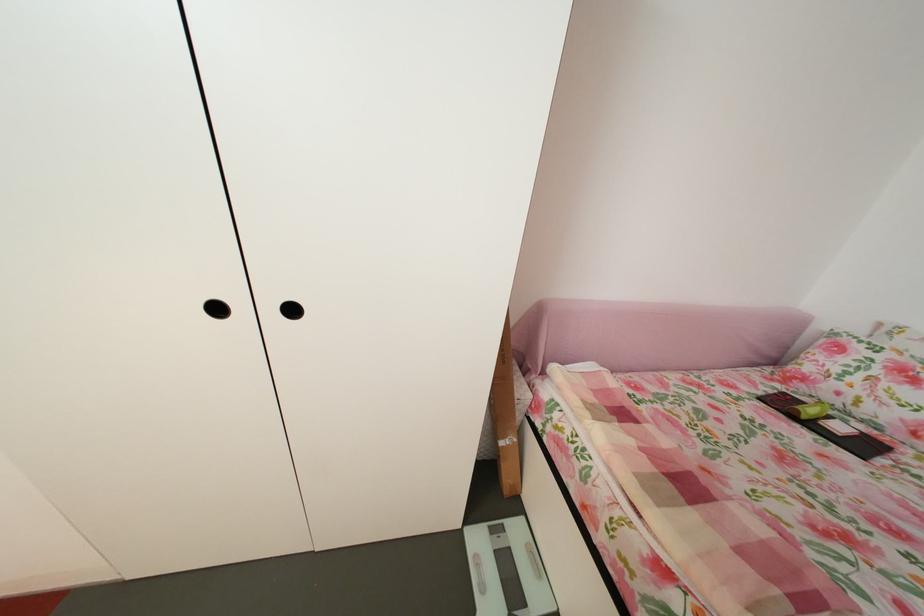
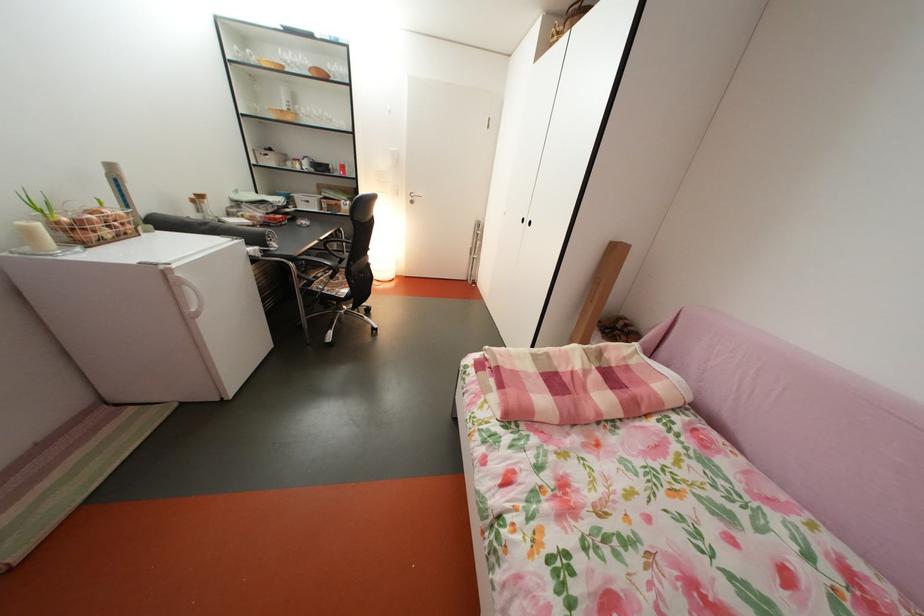
Where in the second image is the point corresponding to pixel 628 431 from the first image?

(604, 374)